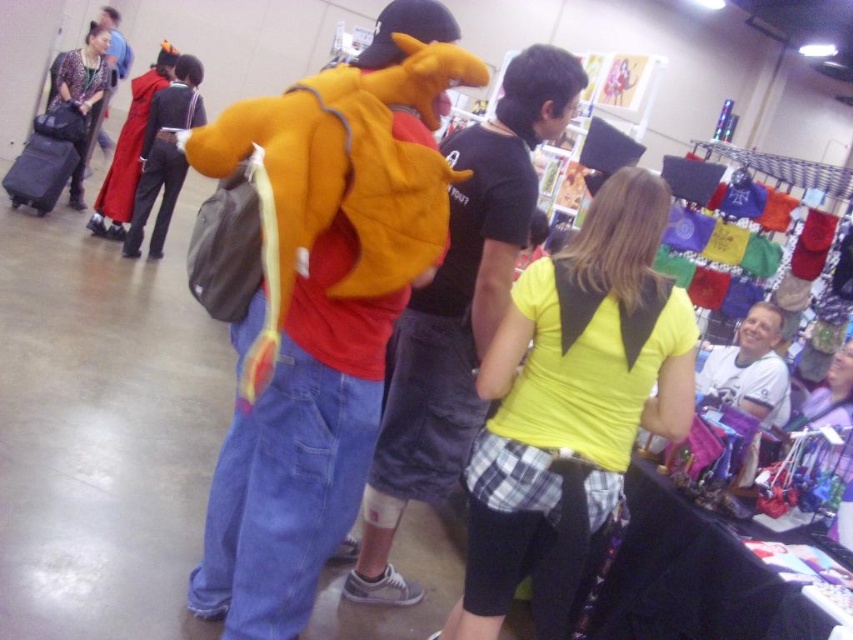
You are standing in the convention center and see two points marked in the image. Which point, point (389, 442) or point (96, 22), is closer to you?

Point (389, 442) is closer to the viewer than point (96, 22).

You are a photographer at the event and need to capture a photo that includes both the yellow fleece backpack at center and the red fabric cape at upper left. Based on their positions, which object should you place on the right side of your camera frame?

The yellow fleece backpack at center should be placed on the right side of your camera frame because it is positioned on the right side of the red fabric cape at upper left.